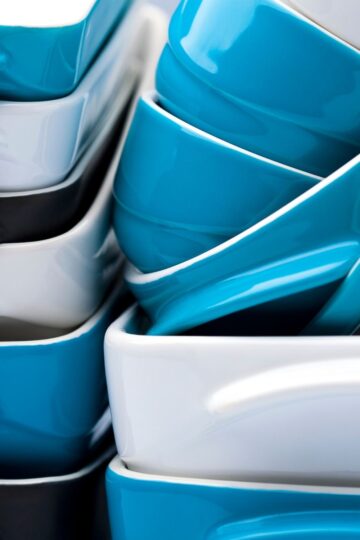
Find the location of a particular element. The image size is (360, 540). blue bowls is located at coordinates point(306,511), point(34,406), point(347,310), point(306,261), point(235,185), point(261,79), point(27,58).